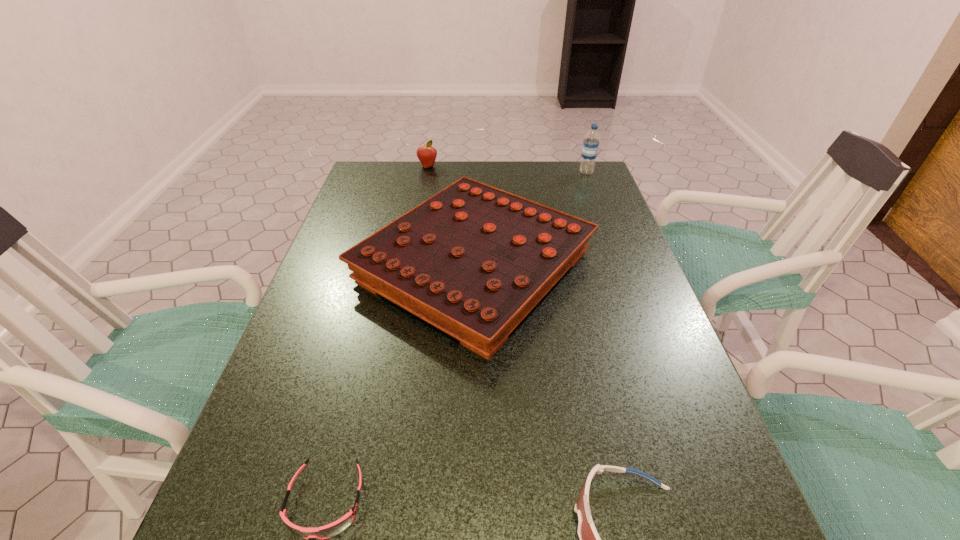
This screenshot has width=960, height=540. In order to click on free space that is in between the tallest object and the apple in this screenshot , I will do `click(507, 169)`.

Select which object appears as the closest to the apple. Please provide its 2D coordinates. Your answer should be formatted as a tuple, i.e. [(x, y)], where the tuple contains the x and y coordinates of a point satisfying the conditions above.

[(473, 260)]

Select which object appears as the fourth closest to the apple. Please provide its 2D coordinates. Your answer should be formatted as a tuple, i.e. [(x, y)], where the tuple contains the x and y coordinates of a point satisfying the conditions above.

[(589, 538)]